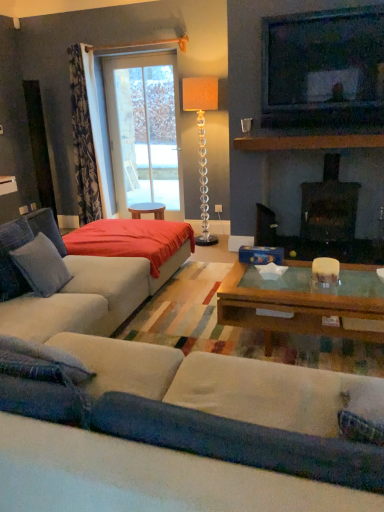
Where is `black glass fireplace at center`? black glass fireplace at center is located at coordinates (329, 206).

Image resolution: width=384 pixels, height=512 pixels. Describe the element at coordinates (201, 139) in the screenshot. I see `translucent glass floor lamp at upper center` at that location.

What do you see at coordinates (205, 406) in the screenshot? Image resolution: width=384 pixels, height=512 pixels. I see `velvet beige couch at lower center` at bounding box center [205, 406].

This screenshot has height=512, width=384. I want to click on transparent glass door at upper center, so click(x=143, y=130).

The width and height of the screenshot is (384, 512). Describe the element at coordinates (143, 130) in the screenshot. I see `transparent glass door at upper center` at that location.

Locate an element on the screen. brown wooden mantle at upper center is located at coordinates (308, 142).

Locate an element on the screen. soft gray fabric pillow at left is located at coordinates (41, 266).

Between soft gray fabric pillow at left and black glass fireplace at center, which one appears on the left side from the viewer's perspective?

Positioned to the left is soft gray fabric pillow at left.

Would you consider soft gray fabric pillow at left to be distant from black glass fireplace at center?

soft gray fabric pillow at left is far away from black glass fireplace at center.

Locate an element on the screen. The width and height of the screenshot is (384, 512). pillow on the left side of black glass fireplace at center is located at coordinates (41, 266).

Can you confirm if floral fabric curtain at left is positioned to the left of transparent glass door at upper center?

Correct, you'll find floral fabric curtain at left to the left of transparent glass door at upper center.

Is floral fabric curtain at left bigger or smaller than transparent glass door at upper center?

In the image, floral fabric curtain at left appears to be larger than transparent glass door at upper center.

Considering the sizes of translucent glass floor lamp at upper center and soft gray fabric pillow at left in the image, is translucent glass floor lamp at upper center taller or shorter than soft gray fabric pillow at left?

Clearly, translucent glass floor lamp at upper center is taller compared to soft gray fabric pillow at left.

Is soft gray fabric pillow at left at the back of translucent glass floor lamp at upper center?

No.

Considering the sizes of translucent glass floor lamp at upper center and soft gray fabric pillow at left in the image, is translucent glass floor lamp at upper center wider or thinner than soft gray fabric pillow at left?

Clearly, translucent glass floor lamp at upper center has more width compared to soft gray fabric pillow at left.

Which object is more forward, soft gray fabric pillow at left or matte black television at upper right?

soft gray fabric pillow at left is in front.

Is soft gray fabric pillow at left surrounding matte black television at upper right?

No, matte black television at upper right is not surrounded by soft gray fabric pillow at left.

The image size is (384, 512). I want to click on television above the soft gray fabric pillow at left (from a real-world perspective), so click(324, 69).

Does point (40, 234) appear closer or farther from the camera than point (376, 88)?

Point (40, 234) is positioned closer to the camera compared to point (376, 88).

Can you tell me how much soft gray fabric pillow at left and translucent glass floor lamp at upper center differ in facing direction?

The angular difference between soft gray fabric pillow at left and translucent glass floor lamp at upper center is 97.1 degrees.

Is soft gray fabric pillow at left next to translucent glass floor lamp at upper center and touching it?

They are not placed beside each other.

Based on the photo, which object is further away from the camera, soft gray fabric pillow at left or translucent glass floor lamp at upper center?

translucent glass floor lamp at upper center is behind.

From a real-world perspective, relative to translucent glass floor lamp at upper center, is velvet beige couch at lower center vertically above or below?

velvet beige couch at lower center is below translucent glass floor lamp at upper center.

Relative to translucent glass floor lamp at upper center, is velvet beige couch at lower center in front or behind?

Visually, velvet beige couch at lower center is located in front of translucent glass floor lamp at upper center.

From the image's perspective, is velvet beige couch at lower center above translucent glass floor lamp at upper center?

No, from the image's perspective, velvet beige couch at lower center is not on top of translucent glass floor lamp at upper center.

Considering the sizes of velvet beige couch at lower center and translucent glass floor lamp at upper center in the image, is velvet beige couch at lower center taller or shorter than translucent glass floor lamp at upper center?

In the image, velvet beige couch at lower center appears to be shorter than translucent glass floor lamp at upper center.

This screenshot has height=512, width=384. Identify the location of plain on the left of transparent glass door at upper center. (136, 243).

Looking at their sizes, would you say red fabric bed at center is wider or thinner than transparent glass door at upper center?

Considering their sizes, red fabric bed at center looks broader than transparent glass door at upper center.

Considering the positions of objects red fabric bed at center and transparent glass door at upper center in the image provided, who is behind, red fabric bed at center or transparent glass door at upper center?

Positioned behind is transparent glass door at upper center.

From a real-world perspective, is red fabric bed at center beneath transparent glass door at upper center?

Correct, in the physical world, red fabric bed at center is lower than transparent glass door at upper center.

Identify the location of pillow above the black glass fireplace at center (from a real-world perspective). (41, 266).

Where is `window screen lying behind the floral fabric curtain at left`? window screen lying behind the floral fabric curtain at left is located at coordinates (143, 130).

Looking at the image, which one is located closer to brown wooden mantle at upper center, floral fabric curtain at left or velvet beige couch at lower center?

The object closer to brown wooden mantle at upper center is floral fabric curtain at left.

In the scene shown: Looking at the image, which one is located closer to floral fabric curtain at left, black glass fireplace at center or red fabric bed at center?

Based on the image, red fabric bed at center appears to be nearer to floral fabric curtain at left.

Which object lies further to the anchor point velvet beige couch at lower center, red fabric bed at center or translucent glass floor lamp at upper center?

translucent glass floor lamp at upper center is positioned further to the anchor velvet beige couch at lower center.

Looking at this image, which object lies nearer to the anchor point translucent glass floor lamp at upper center, black glass fireplace at center or brown wooden mantle at upper center?

brown wooden mantle at upper center.

Considering their positions, is matte black television at upper right positioned closer to black glass fireplace at center than translucent glass floor lamp at upper center?

matte black television at upper right lies closer to black glass fireplace at center than the other object.

Based on their spatial positions, is red fabric bed at center or brown wooden mantle at upper center further from floral fabric curtain at left?

brown wooden mantle at upper center is positioned further to the anchor floral fabric curtain at left.

When comparing their distances from translucent glass floor lamp at upper center, does red fabric bed at center or matte black television at upper right seem further?

red fabric bed at center.

Which object lies nearer to the anchor point translucent glass floor lamp at upper center, transparent glass door at upper center or floral fabric curtain at left?

transparent glass door at upper center lies closer to translucent glass floor lamp at upper center than the other object.

Where is `curtain between velvet beige couch at lower center and transparent glass door at upper center from front to back`? The height and width of the screenshot is (512, 384). curtain between velvet beige couch at lower center and transparent glass door at upper center from front to back is located at coordinates (83, 142).

The height and width of the screenshot is (512, 384). I want to click on lamp between transparent glass door at upper center and brown wooden mantle at upper center from left to right, so click(201, 139).

You are a GUI agent. You are given a task and a screenshot of the screen. Output one action in this format:
    pyautogui.click(x=<x>, y=<y>)
    Task: Click on the plain between soft gray fabric pillow at left and matte black television at upper right in the horizontal direction
    Image resolution: width=384 pixels, height=512 pixels.
    Given the screenshot: What is the action you would take?
    136,243

Where is `lamp between soft gray fabric pillow at left and floral fabric curtain at left in the front-back direction`? lamp between soft gray fabric pillow at left and floral fabric curtain at left in the front-back direction is located at coordinates (201, 139).